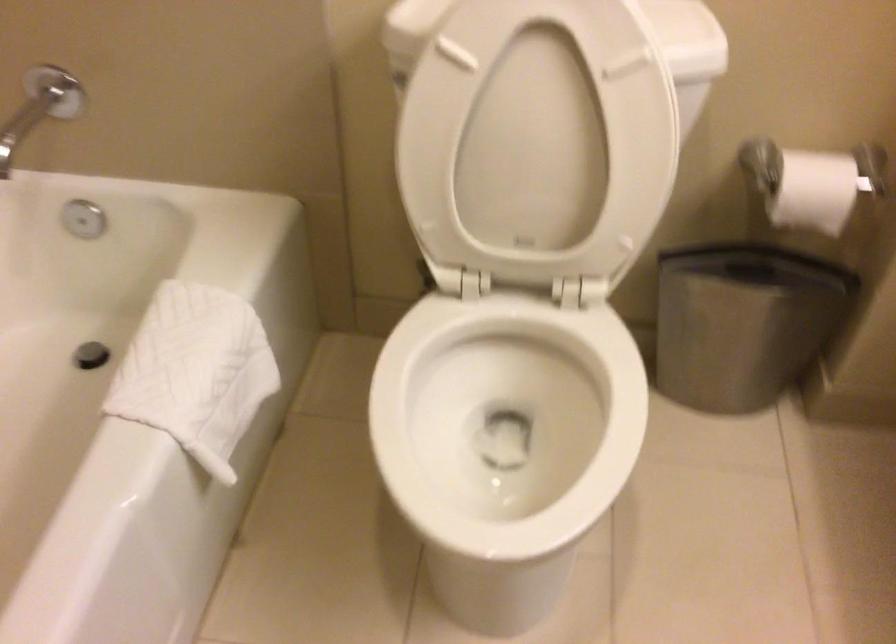
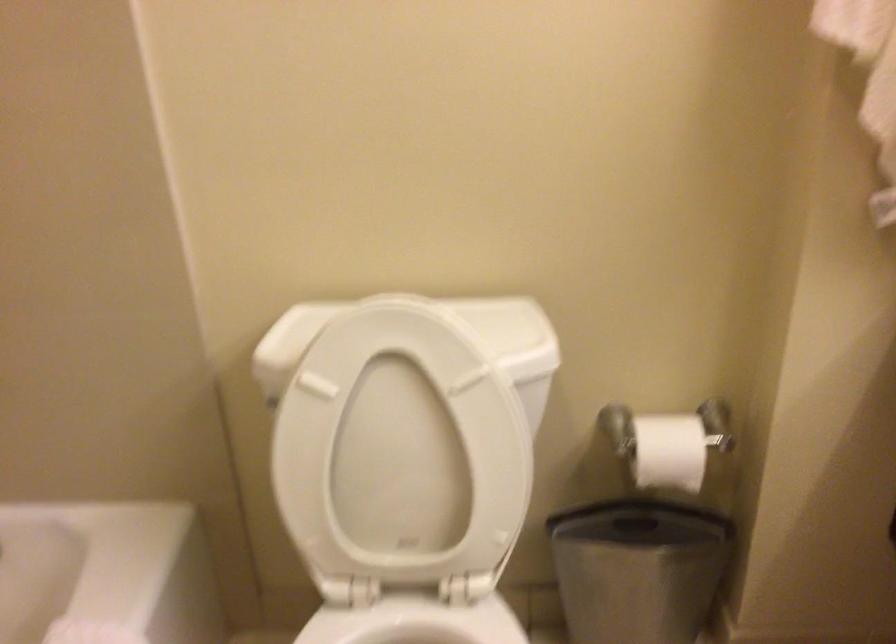
What movement of the cameraman would produce the second image?

The cameraman walked toward right, backward.